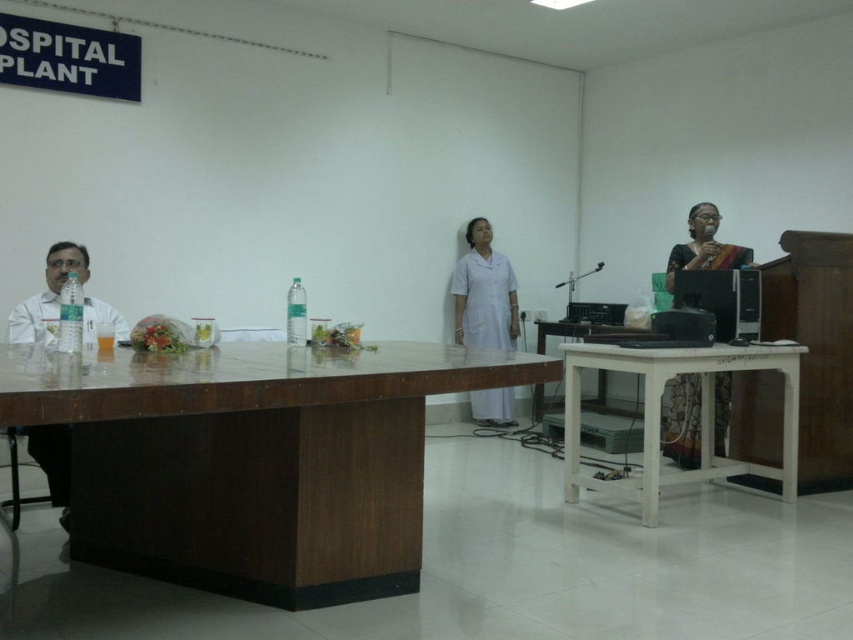
Which is more to the left, brown wood table at center or white matte shirt at left?

white matte shirt at left is more to the left.

Does brown wood table at center have a lesser width compared to white matte shirt at left?

No, brown wood table at center is not thinner than white matte shirt at left.

What do you see at coordinates (253, 460) in the screenshot? The height and width of the screenshot is (640, 853). I see `brown wood table at center` at bounding box center [253, 460].

Locate an element on the screen. The height and width of the screenshot is (640, 853). brown wood table at center is located at coordinates (253, 460).

Which is above, white wooden table at lower right or silk saree at right?

white wooden table at lower right

Can you confirm if white wooden table at lower right is shorter than silk saree at right?

Incorrect, white wooden table at lower right's height does not fall short of silk saree at right's.

The width and height of the screenshot is (853, 640). I want to click on white wooden table at lower right, so click(659, 416).

The image size is (853, 640). I want to click on white wooden table at lower right, so click(659, 416).

Can you confirm if white smooth uniform at center is smaller than white matte shirt at left?

Yes, white smooth uniform at center is smaller than white matte shirt at left.

Can you confirm if white smooth uniform at center is shorter than white matte shirt at left?

In fact, white smooth uniform at center may be taller than white matte shirt at left.

Is point (515, 308) closer to viewer compared to point (22, 317)?

No, it is not.

The image size is (853, 640). I want to click on white smooth uniform at center, so click(x=485, y=292).